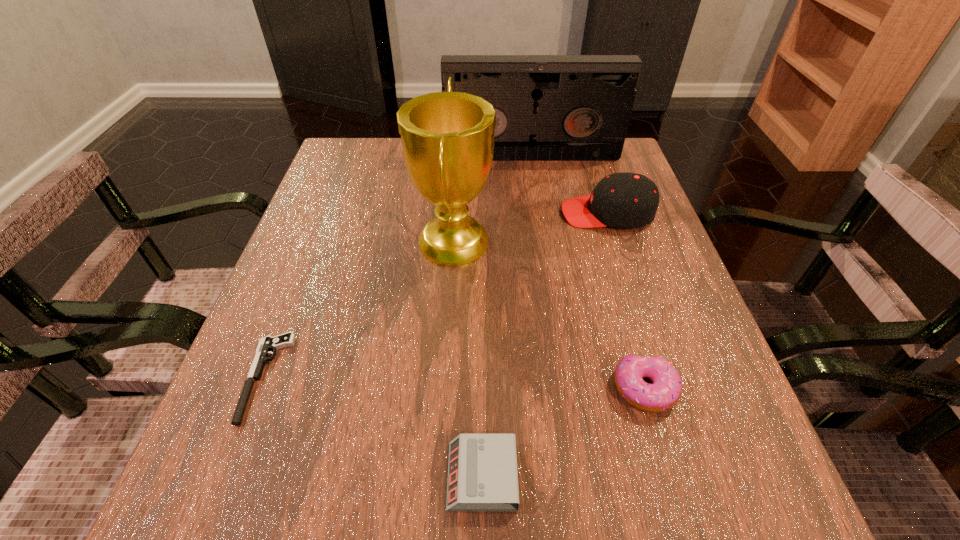
Image resolution: width=960 pixels, height=540 pixels. Identify the location of cap at the right edge. (622, 200).

Locate an element on the screen. This screenshot has height=540, width=960. doughnut at the right edge is located at coordinates (665, 392).

The width and height of the screenshot is (960, 540). I want to click on object that is at the far right corner, so click(x=548, y=107).

Where is `vacant space at the far edge of the desktop`? The width and height of the screenshot is (960, 540). vacant space at the far edge of the desktop is located at coordinates (492, 188).

At what (x,y) coordinates should I click in order to perform the action: click on free location at the near edge. Please return your answer as a coordinate pair (x, y). This screenshot has height=540, width=960. Looking at the image, I should click on (555, 471).

Locate an element on the screen. This screenshot has height=540, width=960. free space at the left edge is located at coordinates (329, 245).

At what (x,y) coordinates should I click in order to perform the action: click on free space at the right edge. Please return your answer as a coordinate pair (x, y). The image size is (960, 540). Looking at the image, I should click on (650, 302).

You are a GUI agent. You are given a task and a screenshot of the screen. Output one action in this format:
    pyautogui.click(x=<x>, y=<y>)
    Task: Click on the vacant space at the far left corner
    This screenshot has width=960, height=540.
    Given the screenshot: What is the action you would take?
    (366, 143)

Where is `vacant space at the near right corner of the desktop`? vacant space at the near right corner of the desktop is located at coordinates (660, 523).

Identify the location of free space between the cap and the doughnut. (626, 301).